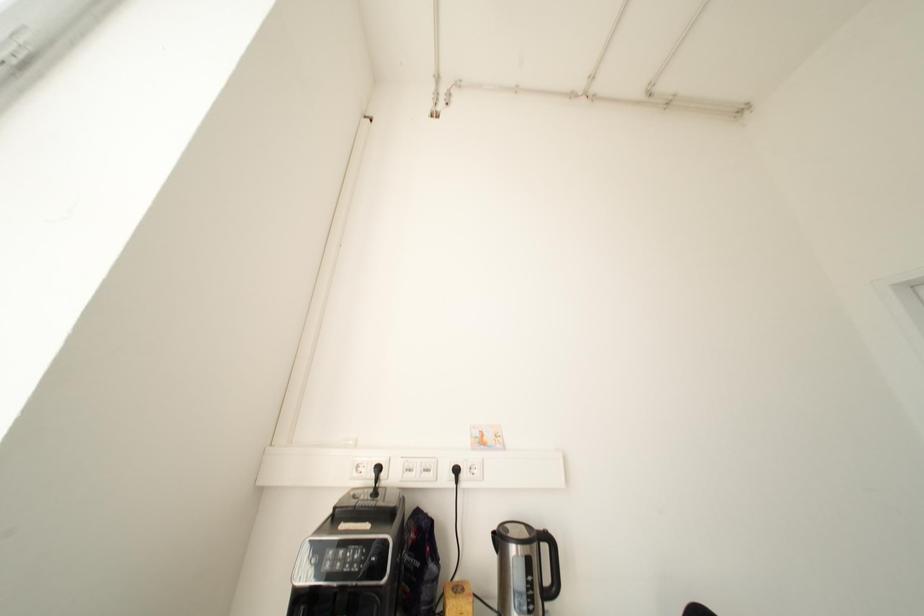
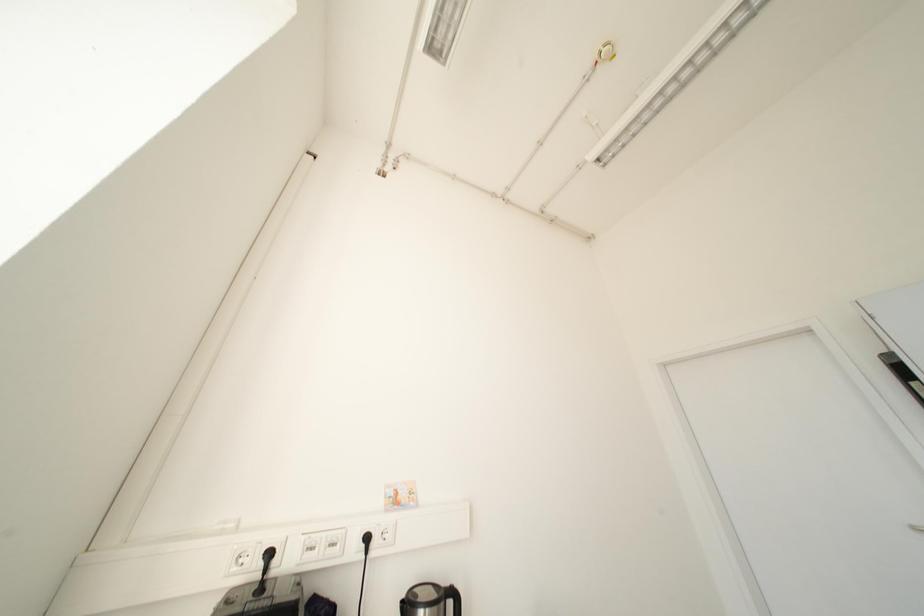
Which direction would the cameraman need to move to produce the second image?

The movement direction of the cameraman is left, backward.